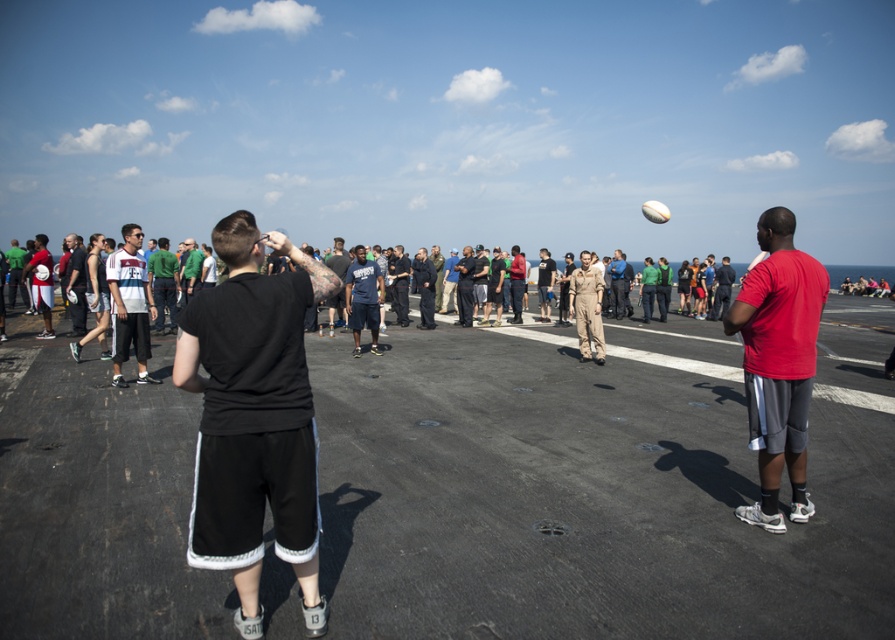
Question: Which point is closer to the camera taking this photo?

Choices:
 (A) (781, 273)
 (B) (188, 244)
 (C) (330, 260)
 (D) (120, 340)

Answer: (A)

Question: Among these objects, which one is farthest from the camera?

Choices:
 (A) red matte shirt at right
 (B) white matte shirt at left
 (C) green fabric shirt at center
 (D) dark blue t-shirt at center

Answer: (C)

Question: Which of these objects is positioned closest to the white matte shirt at left?

Choices:
 (A) red matte shirt at right
 (B) dark blue t-shirt at center
 (C) green fabric shirt at center

Answer: (C)

Question: Is dark blue t-shirt at center positioned before green fabric shirt at center?

Choices:
 (A) yes
 (B) no

Answer: (A)

Question: Observing the image, what is the correct spatial positioning of white matte shirt at left in reference to dark blue t-shirt at center?

Choices:
 (A) below
 (B) above

Answer: (A)

Question: Is red matte shirt at right smaller than green fabric shirt at center?

Choices:
 (A) no
 (B) yes

Answer: (B)